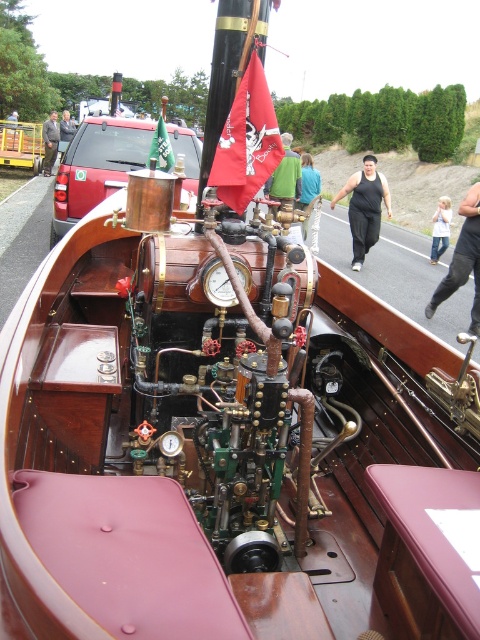
Question: Which object is positioned closest to the black fabric at center?

Choices:
 (A) dark green fabric jacket at upper left
 (B) dark gray suit at left
 (C) matte silver gauge at center
 (D) metallic red car at left

Answer: (D)

Question: Where is black fabric pants at center located in relation to dark blue jeans at center in the image?

Choices:
 (A) above
 (B) below

Answer: (B)

Question: Which object is closer to the camera taking this photo?

Choices:
 (A) matte brass gauge at center
 (B) metallic red car at left

Answer: (A)

Question: Does dark blue jeans at center have a larger size compared to dark gray suit at left?

Choices:
 (A) yes
 (B) no

Answer: (B)

Question: Can you confirm if matte brass gauge at center is positioned to the left of jeans at right?

Choices:
 (A) no
 (B) yes

Answer: (B)

Question: Among these objects, which one is nearest to the camera?

Choices:
 (A) jeans at right
 (B) black fabric pants at center

Answer: (B)